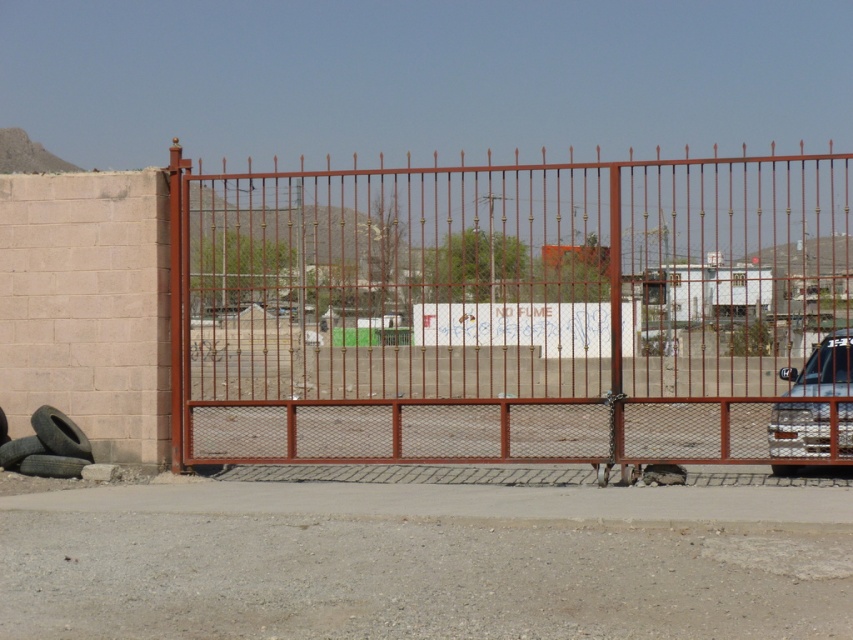
You are driving a metallic silver car at right and want to enter through the rusty metal gate at center. Based on the scene description, can your car fit through the gate?

The rusty metal gate at center has a width larger than the metallic silver car at right, so the car can fit through the gate.

You are a delivery driver trying to enter through the gate. The gate is closed, but you notice the metallic silver car at right and the black rubber tire at lower left. Which object is positioned higher relative to the other?

The metallic silver car at right is located above the black rubber tire at lower left, so it is positioned higher.

You need to pass through the rusty metal gate at center with a box that is 1.2 meters wide. Can the box fit through the gate? Use the dark gray rubber tire at lower left as a reference for the gate width.

The rusty metal gate at center might be wider than dark gray rubber tire at lower left. Since the tire is at the lower left and the gate is at the center, we can estimate that the gate is wider than the tire. If the tire is approximately 1 meter in diameter, the gate might be around 1.5 meters wide. Therefore, the 1.2 meter wide box can likely fit through the rusty metal gate at center.